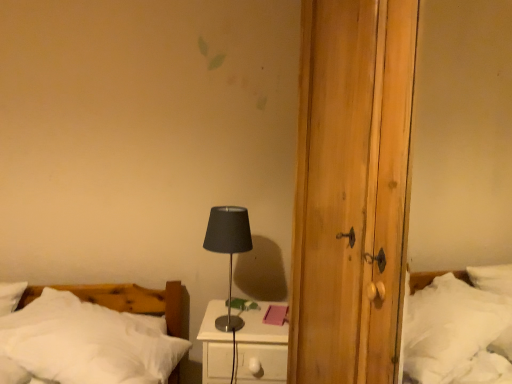
Question: Is white glossy nightstand at center in front of black metallic table lamp at center?

Choices:
 (A) no
 (B) yes

Answer: (A)

Question: Is white glossy nightstand at center facing towards black metallic table lamp at center?

Choices:
 (A) no
 (B) yes

Answer: (A)

Question: From the image's perspective, is white glossy nightstand at center on top of black metallic table lamp at center?

Choices:
 (A) no
 (B) yes

Answer: (A)

Question: From a real-world perspective, is white glossy nightstand at center under black metallic table lamp at center?

Choices:
 (A) yes
 (B) no

Answer: (A)

Question: Is white glossy nightstand at center taller than black metallic table lamp at center?

Choices:
 (A) yes
 (B) no

Answer: (B)

Question: From the image's perspective, is white soft bed at lower left located above or below white glossy nightstand at center?

Choices:
 (A) below
 (B) above

Answer: (B)

Question: Considering the positions of white soft bed at lower left and white glossy nightstand at center in the image, is white soft bed at lower left taller or shorter than white glossy nightstand at center?

Choices:
 (A) tall
 (B) short

Answer: (B)

Question: In terms of width, does white soft bed at lower left look wider or thinner when compared to white glossy nightstand at center?

Choices:
 (A) wide
 (B) thin

Answer: (A)

Question: Considering the positions of point (109, 379) and point (227, 345), is point (109, 379) closer or farther from the camera than point (227, 345)?

Choices:
 (A) farther
 (B) closer

Answer: (B)

Question: From a real-world perspective, relative to white soft bed at lower left, is white glossy nightstand at center vertically above or below?

Choices:
 (A) above
 (B) below

Answer: (B)

Question: In terms of width, does white glossy nightstand at center look wider or thinner when compared to white soft bed at lower left?

Choices:
 (A) wide
 (B) thin

Answer: (B)

Question: From the image's perspective, is white glossy nightstand at center located above or below white soft bed at lower left?

Choices:
 (A) below
 (B) above

Answer: (A)

Question: Visually, is white glossy nightstand at center positioned to the left or to the right of white soft bed at lower left?

Choices:
 (A) left
 (B) right

Answer: (B)

Question: Looking at the image, does black metallic table lamp at center seem bigger or smaller compared to white soft bed at lower left?

Choices:
 (A) small
 (B) big

Answer: (A)

Question: Is black metallic table lamp at center inside or outside of white soft bed at lower left?

Choices:
 (A) inside
 (B) outside

Answer: (B)